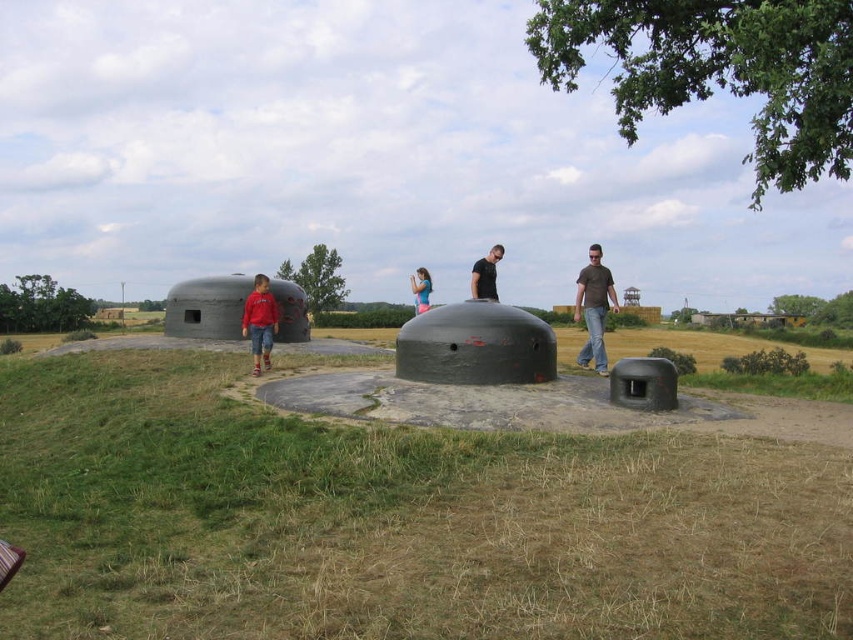
Question: Is matte red shirt at left to the right of black matte shirt at center from the viewer's perspective?

Choices:
 (A) no
 (B) yes

Answer: (A)

Question: Is brown cotton shirt at center to the right of blue denim jeans at center from the viewer's perspective?

Choices:
 (A) no
 (B) yes

Answer: (B)

Question: Can you confirm if green grassy at center is smaller than matte red shirt at left?

Choices:
 (A) no
 (B) yes

Answer: (B)

Question: Among these points, which one is farthest from the camera?

Choices:
 (A) (422, 374)
 (B) (268, 317)
 (C) (430, 291)

Answer: (C)

Question: Among these objects, which one is nearest to the camera?

Choices:
 (A) matte red shirt at left
 (B) blue denim jeans at center

Answer: (A)

Question: Which point is closer to the camera?

Choices:
 (A) black matte shirt at center
 (B) green grassy at center

Answer: (B)